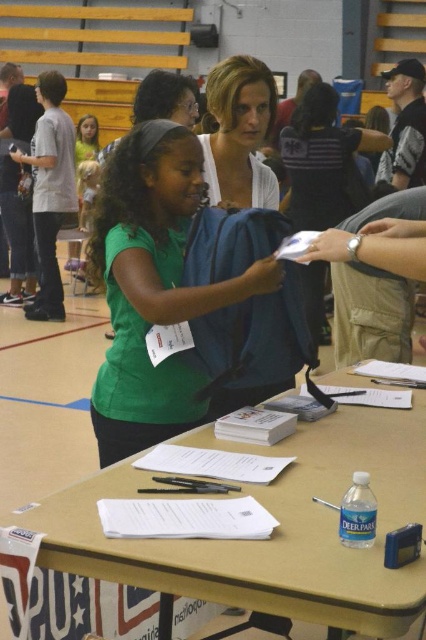
Does point (399, 477) come closer to viewer compared to point (245, 196)?

Yes, point (399, 477) is closer to viewer.

Locate an element on the screen. This screenshot has height=640, width=426. matte plastic table at center is located at coordinates (276, 532).

Consider the image. Is matte plastic table at center bigger than green matte shirt at center?

Indeed, matte plastic table at center has a larger size compared to green matte shirt at center.

Does point (226, 580) lie in front of point (166, 189)?

That is True.

You are a GUI agent. You are given a task and a screenshot of the screen. Output one action in this format:
    pyautogui.click(x=<x>, y=<y>)
    Task: Click on the matte plastic table at center
    Image resolution: width=426 pixels, height=640 pixels.
    Given the screenshot: What is the action you would take?
    pyautogui.click(x=276, y=532)

Can you confirm if green matte shirt at center is positioned above matte white blouse at center?

No.

Is green matte shirt at center to the left of matte white blouse at center from the viewer's perspective?

Indeed, green matte shirt at center is positioned on the left side of matte white blouse at center.

Between point (241, 288) and point (256, 67), which one is positioned behind?

The point (256, 67) is more distant.

Find the location of a particular element. The width and height of the screenshot is (426, 640). green matte shirt at center is located at coordinates (152, 288).